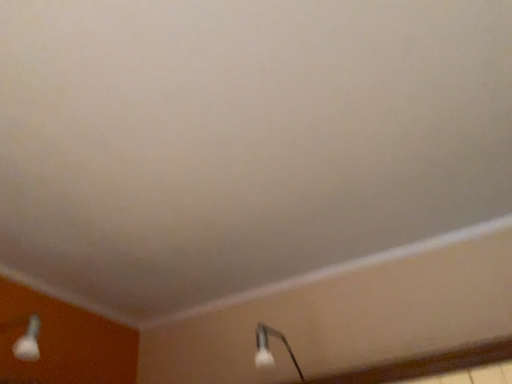
Where is `white glossy lamp at lower center`? This screenshot has width=512, height=384. white glossy lamp at lower center is located at coordinates (269, 348).

What is the approximate width of white glossy lamp at lower center?

22.93 centimeters.

The height and width of the screenshot is (384, 512). What do you see at coordinates (269, 348) in the screenshot?
I see `white glossy lamp at lower center` at bounding box center [269, 348].

Measure the distance between white glossy lamp at lower center and camera.

white glossy lamp at lower center and camera are 4.45 feet apart from each other.

Locate an element on the screen. This screenshot has width=512, height=384. white glossy lamp at lower center is located at coordinates (269, 348).